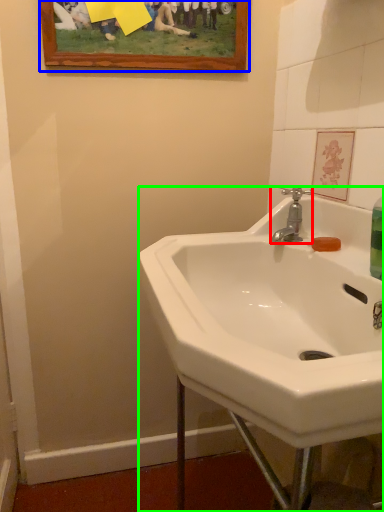
Question: Which object is positioned closest to tap (highlighted by a red box)? Select from picture frame (highlighted by a blue box) and sink (highlighted by a green box).

Choices:
 (A) picture frame
 (B) sink

Answer: (B)